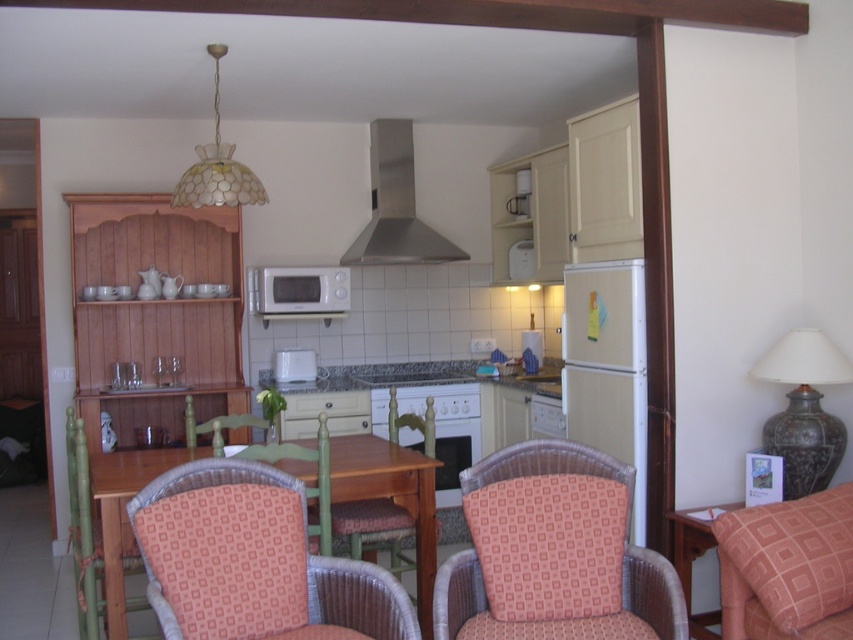
Question: Which of these objects is positioned closest to the pink fabric armchair at lower right?

Choices:
 (A) white glossy microwave at center
 (B) orange fabric armchair at lower right
 (C) matte dark brown vase at right
 (D) white glossy oven at center

Answer: (B)

Question: Is matte dark brown vase at right in front of white glossy microwave at center?

Choices:
 (A) no
 (B) yes

Answer: (B)

Question: Which object is closer to the camera taking this photo?

Choices:
 (A) white glossy oven at center
 (B) white matte microwave at center
 (C) stainless steel exhaust hood at upper center
 (D) matte dark brown vase at right

Answer: (D)

Question: Is beige matte refrigerator at right smaller than woven fabric armchair at center?

Choices:
 (A) no
 (B) yes

Answer: (B)

Question: Does white glossy oven at center lie behind woven fabric armchair at center?

Choices:
 (A) yes
 (B) no

Answer: (A)

Question: Considering the real-world distances, which object is closest to the patterned fabric chair at lower left?

Choices:
 (A) beige matte refrigerator at right
 (B) white glossy oven at center
 (C) pink fabric armchair at lower right

Answer: (C)